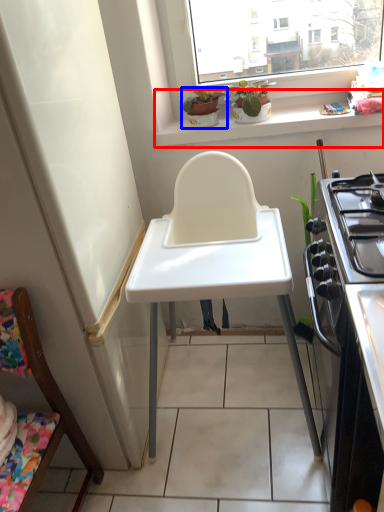
Question: Which point is closer to the camera, window sill (highlighted by a red box) or houseplant (highlighted by a blue box)?

Choices:
 (A) window sill
 (B) houseplant

Answer: (A)